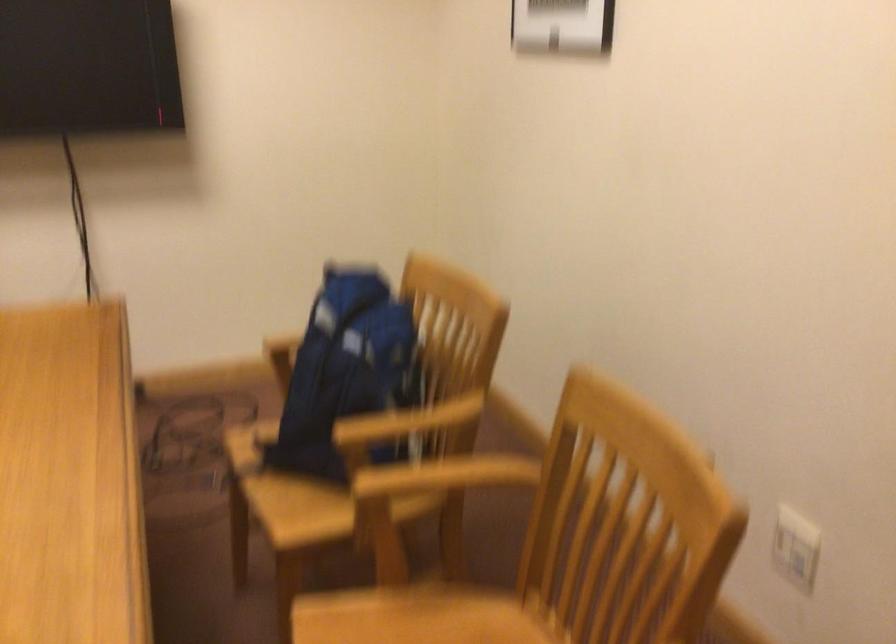
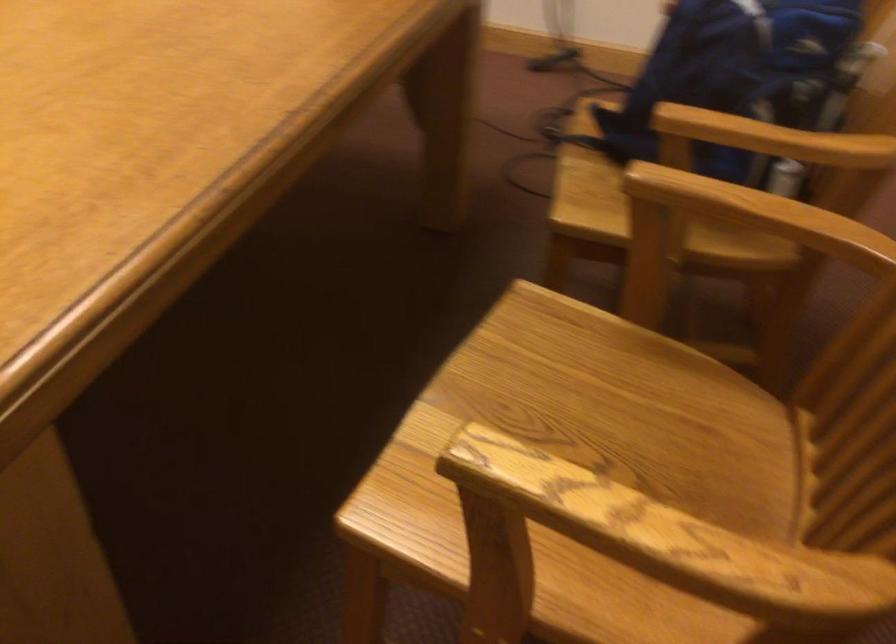
Where in the second image is the point corresponding to the point at 280,500 from the first image?

(584, 187)